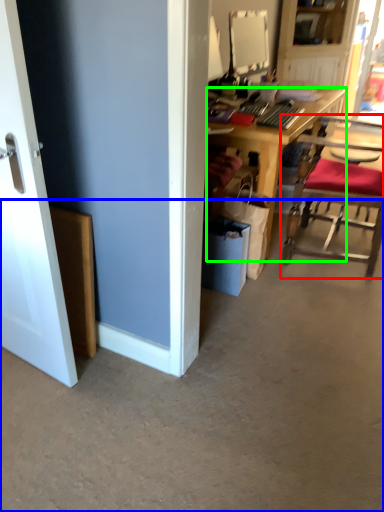
Question: Which object is positioned closest to chair (highlighted by a red box)? Select from concrete (highlighted by a blue box) and desk (highlighted by a green box).

Choices:
 (A) concrete
 (B) desk

Answer: (B)